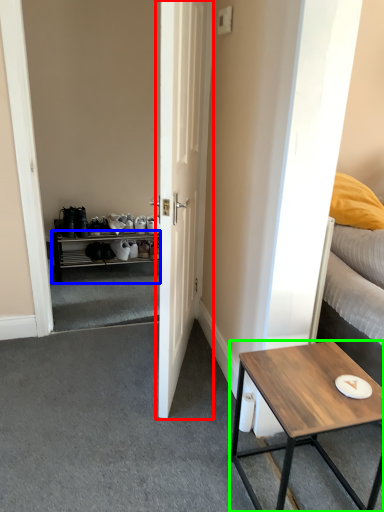
Question: Based on their relative distances, which object is farther from door (highlighted by a red box)? Choose from cabinetry (highlighted by a blue box) and coffee table (highlighted by a green box).

Choices:
 (A) cabinetry
 (B) coffee table

Answer: (A)